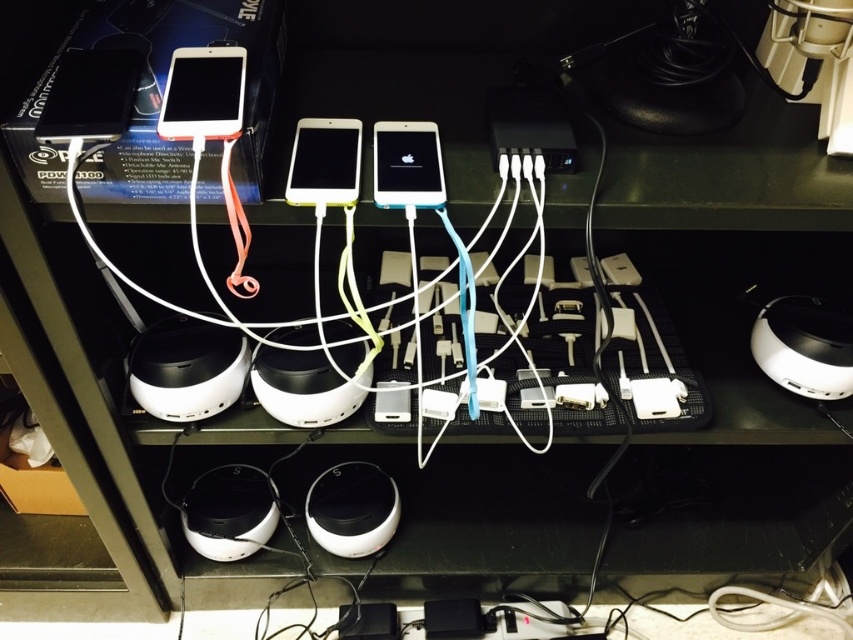
Does matte black phone at upper left appear on the right side of matte white tablet at upper left?

No, matte black phone at upper left is not to the right of matte white tablet at upper left.

How distant is matte black phone at upper left from matte white tablet at upper left?

2.26 inches

Locate an element on the screen. The height and width of the screenshot is (640, 853). matte black phone at upper left is located at coordinates (90, 96).

Is point (73, 67) positioned before point (407, 202)?

That is True.

Which is more to the right, matte black phone at upper left or white glossy iphone at center?

From the viewer's perspective, white glossy iphone at center appears more on the right side.

Is point (53, 83) in front of point (376, 179)?

Yes, point (53, 83) is in front of point (376, 179).

Find the location of `matte black phone at upper left`. matte black phone at upper left is located at coordinates (90, 96).

In the scene shown: Who is shorter, white matte phone at center or white glossy iphone at center?

white matte phone at center is shorter.

Does point (341, 122) come behind point (433, 152)?

Yes, it is.

Is point (329, 156) farther from camera compared to point (383, 132)?

That is False.

Where is `white matte phone at center`? white matte phone at center is located at coordinates (323, 163).